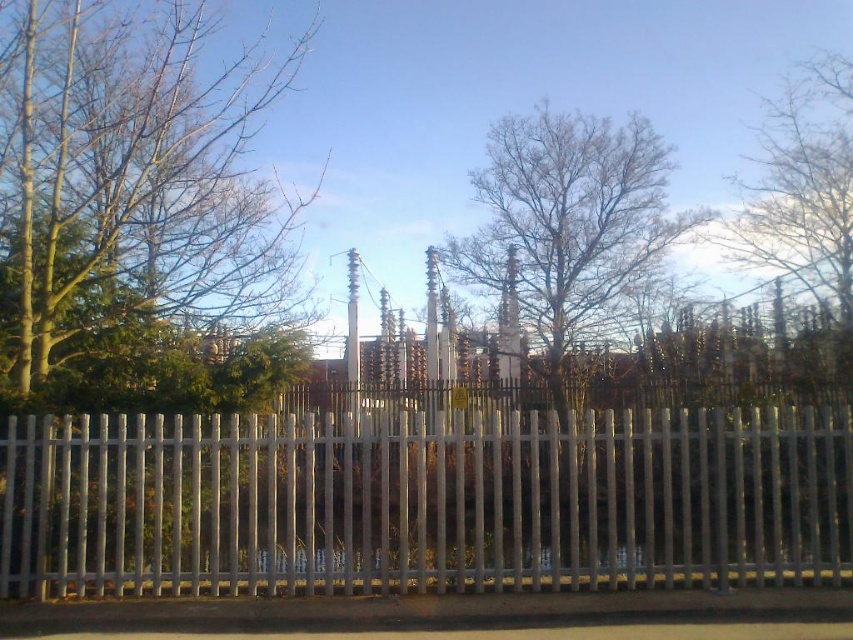
You are standing at the point with coordinates point (13, 362) and want to walk towards the point with coordinates point (822, 461). Given the scene described, will the white picket fence block your path?

Point (822, 461) is behind point (13, 362), so the white picket fence in the foreground will block your path to point (822, 461).

You are standing in front of the white picket fence and notice two points marked in the scene. The first point is at coordinate point (405, 579) and the second is at point (805, 81). Which of these points is closer to you?

Point (405, 579) is closer to the viewer than point (805, 81).

You are standing in a park and see the white metal fence at center and the green leafy tree at left. Which object is closer to you?

The white metal fence at center is closer to you because it is positioned in front of the green leafy tree at left.